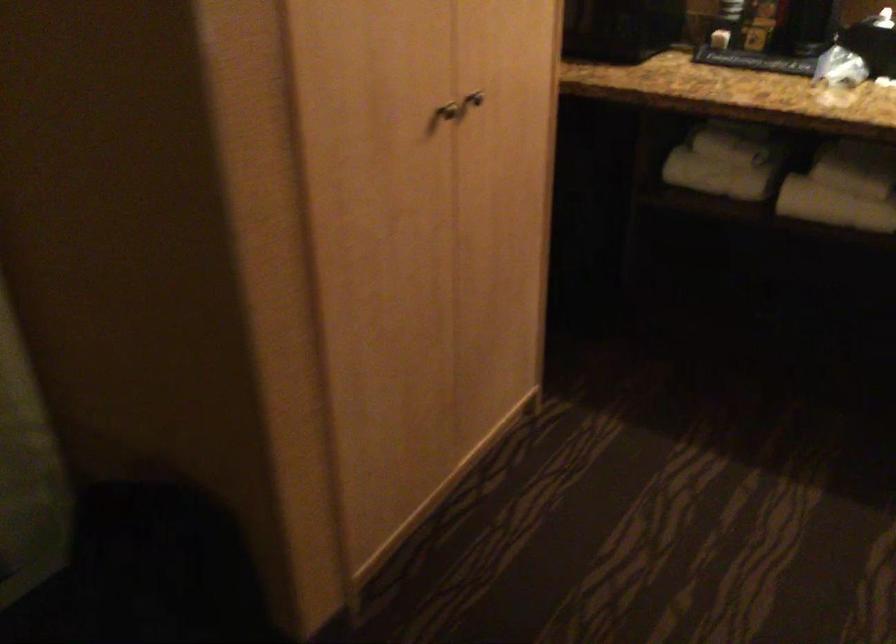
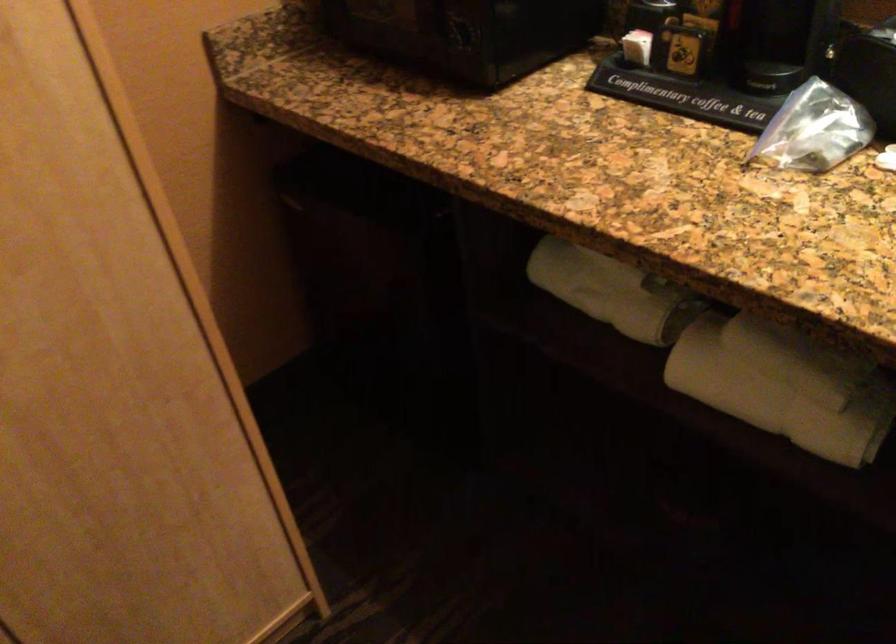
In the second image, find the point that corresponds to point (718, 176) in the first image.

(596, 290)